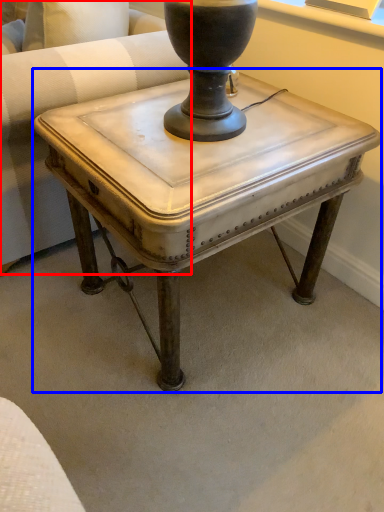
Question: Which of the following is the closest to the observer, swivel chair (highlighted by a red box) or table (highlighted by a blue box)?

Choices:
 (A) swivel chair
 (B) table

Answer: (B)